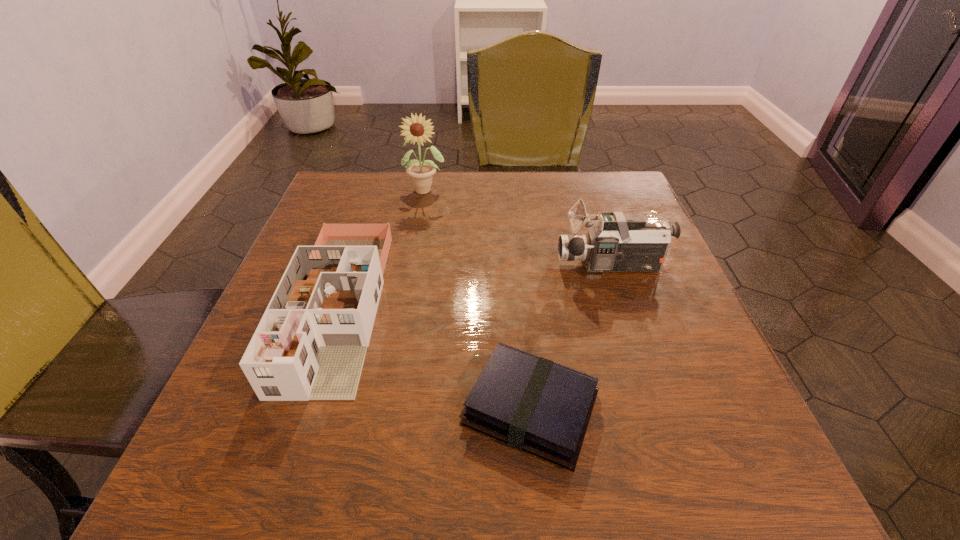
Find the location of a particular element. free spot at the near left corner of the desktop is located at coordinates (220, 496).

You are a GUI agent. You are given a task and a screenshot of the screen. Output one action in this format:
    pyautogui.click(x=<x>, y=<y>)
    Task: Click on the free spot at the far right corner of the desktop
    This screenshot has height=540, width=960.
    Given the screenshot: What is the action you would take?
    pyautogui.click(x=608, y=176)

The height and width of the screenshot is (540, 960). In the image, there is a desktop. Identify the location of vacant region at the near right corner. (713, 477).

You are a GUI agent. You are given a task and a screenshot of the screen. Output one action in this format:
    pyautogui.click(x=<x>, y=<y>)
    Task: Click on the free space that is in between the shortest object and the sunflower
    This screenshot has width=960, height=540.
    Given the screenshot: What is the action you would take?
    pyautogui.click(x=478, y=299)

I want to click on free area in between the second shortest object and the second tallest object, so click(x=475, y=286).

Find the location of a particular element. This screenshot has height=540, width=960. unoccupied position between the third shortest object and the dollhouse is located at coordinates (475, 286).

The height and width of the screenshot is (540, 960). What are the coordinates of `free space between the shortest object and the third tallest object` in the screenshot? It's located at (435, 357).

This screenshot has width=960, height=540. Identify the location of unoccupied area between the camcorder and the tallest object. (519, 227).

Find the location of a particular element. free spot between the book and the camcorder is located at coordinates (571, 337).

The height and width of the screenshot is (540, 960). Identify the location of vacant space that's between the second shortest object and the book. (435, 357).